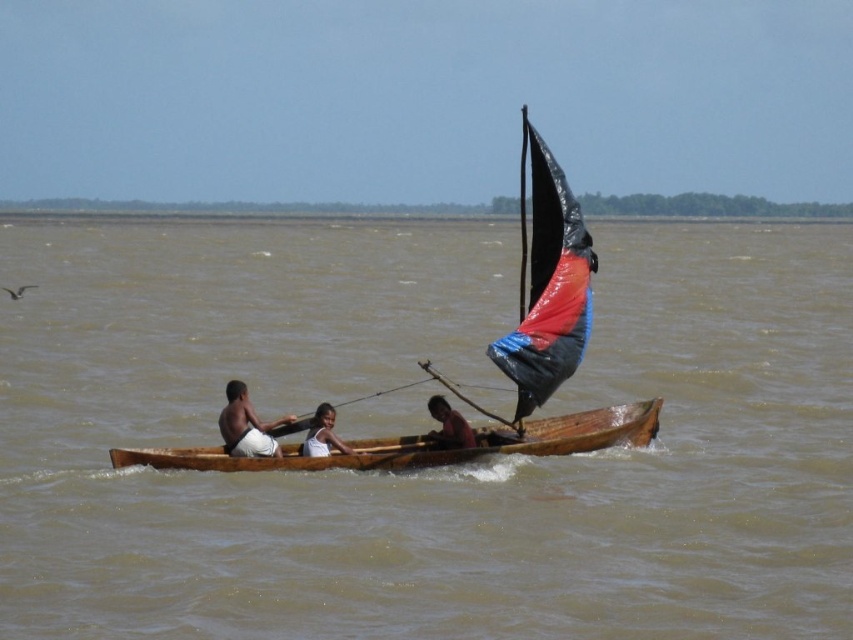
Based on the photo, which of these two, brown muddy water at center or white fabric shirt at center, stands taller?

Standing taller between the two is brown muddy water at center.

Does brown muddy water at center appear on the left side of white fabric shirt at center?

No, brown muddy water at center is not to the left of white fabric shirt at center.

This screenshot has width=853, height=640. Identify the location of brown muddy water at center. (428, 470).

Is black plastic sail at upper right in front of wooden canoe at center?

Yes, black plastic sail at upper right is closer to the viewer.

In the scene shown: Does black plastic sail at upper right appear under wooden canoe at center?

No, black plastic sail at upper right is not below wooden canoe at center.

Between point (529, 138) and point (437, 440), which one is positioned in front?

Positioned in front is point (529, 138).

The image size is (853, 640). What are the coordinates of `black plastic sail at upper right` in the screenshot? It's located at (547, 284).

The width and height of the screenshot is (853, 640). What do you see at coordinates (428, 470) in the screenshot?
I see `brown muddy water at center` at bounding box center [428, 470].

Does brown muddy water at center have a lesser height compared to black plastic sail at upper right?

No, brown muddy water at center is not shorter than black plastic sail at upper right.

Measure the distance between point (119, 388) and camera.

Point (119, 388) and camera are 47.79 meters apart.

Identify the location of brown muddy water at center. (428, 470).